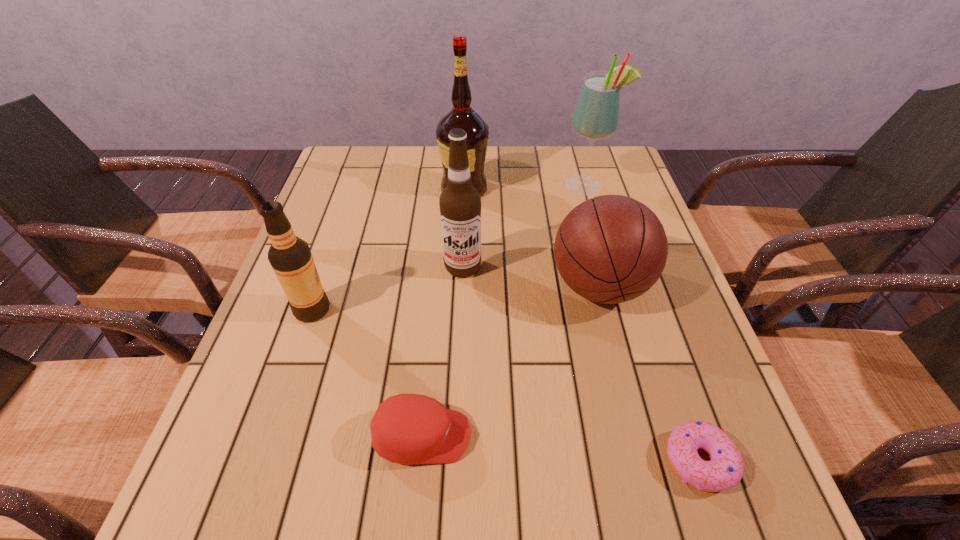
Image resolution: width=960 pixels, height=540 pixels. I want to click on vacant area located on the front of the basketball, so click(x=617, y=359).

Identify the location of free space located on the front-facing side of the cap. (587, 436).

In order to click on free space located 0.330m on the back of the doughnut in this screenshot , I will do `click(640, 291)`.

Locate an element on the screen. Image resolution: width=960 pixels, height=540 pixels. object present at the near edge is located at coordinates (725, 469).

Locate an element on the screen. object that is at the left edge is located at coordinates (290, 257).

The image size is (960, 540). I want to click on alcohol situated at the right edge, so click(x=596, y=115).

Find the location of a particular element. basketball at the right edge is located at coordinates (610, 249).

Image resolution: width=960 pixels, height=540 pixels. Find the location of `doughnut positioned at the right edge`. doughnut positioned at the right edge is located at coordinates (725, 469).

Locate an element on the screen. The width and height of the screenshot is (960, 540). object present at the far right corner is located at coordinates (596, 115).

The width and height of the screenshot is (960, 540). What are the coordinates of `object that is positioned at the near right corner` in the screenshot? It's located at (725, 469).